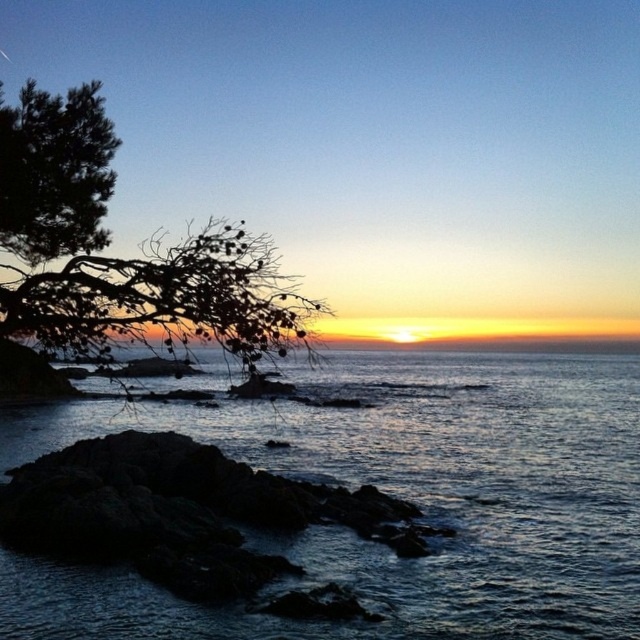
Question: Which object is the closest to the dark green leafy tree at left?

Choices:
 (A) dark blue water at center
 (B) dark rock at lower left

Answer: (B)

Question: Can you confirm if dark blue water at center is wider than dark rock at lower left?

Choices:
 (A) yes
 (B) no

Answer: (A)

Question: Which object is positioned closest to the dark rock at lower left?

Choices:
 (A) dark blue water at center
 (B) dark green leafy tree at left

Answer: (B)

Question: In this image, where is dark green leafy tree at left located relative to dark rock at lower left?

Choices:
 (A) left
 (B) right

Answer: (A)

Question: Is dark blue water at center positioned in front of dark rock at lower left?

Choices:
 (A) no
 (B) yes

Answer: (B)

Question: Which object is closer to the camera taking this photo?

Choices:
 (A) dark green leafy tree at left
 (B) dark blue water at center
 (C) dark rock at lower left

Answer: (A)